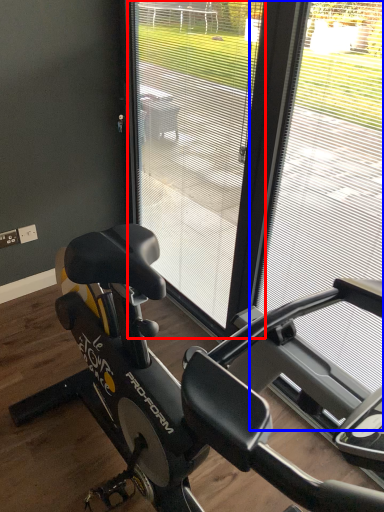
Question: Which point is further to the camera, screen door (highlighted by a red box) or window frame (highlighted by a blue box)?

Choices:
 (A) screen door
 (B) window frame

Answer: (A)